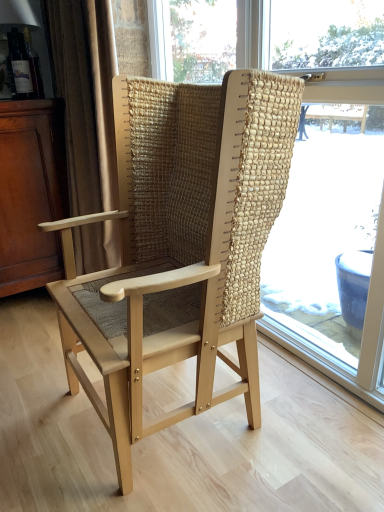
Question: Is point (317, 197) closer or farther from the camera than point (104, 421)?

Choices:
 (A) farther
 (B) closer

Answer: (A)

Question: From a real-world perspective, is natural woven fabric chair at center physically located above or below natural wood chair at center?

Choices:
 (A) above
 (B) below

Answer: (A)

Question: Considering the real-world distances, which object is closest to the mahogany wood dresser at left?

Choices:
 (A) beige fabric curtain at left
 (B) natural woven fabric chair at center
 (C) natural wood chair at center

Answer: (A)

Question: Which object is the closest to the natural wood chair at center?

Choices:
 (A) natural woven fabric chair at center
 (B) mahogany wood dresser at left
 (C) beige fabric curtain at left

Answer: (C)